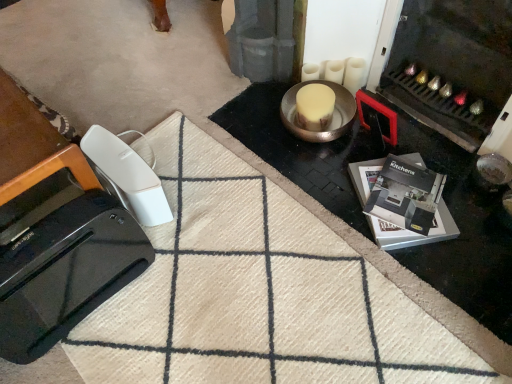
Find the location of a particular element. The width and height of the screenshot is (512, 384). free space to the right of white plastic remote at lower left, marked as the second home appliance in a front-to-back arrangement is located at coordinates (199, 196).